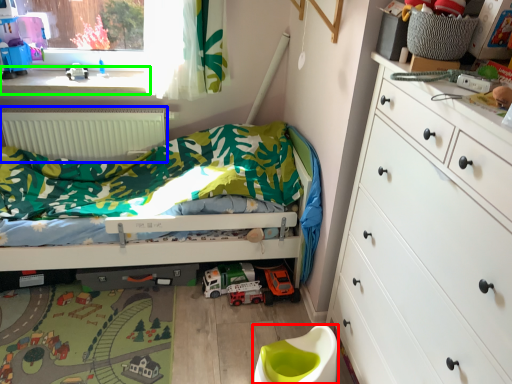
Question: Estimate the real-world distances between objects in this image. Which object is farther from toilet bowl (highlighted by a red box), radiator (highlighted by a blue box) or window sill (highlighted by a green box)?

Choices:
 (A) radiator
 (B) window sill

Answer: (B)